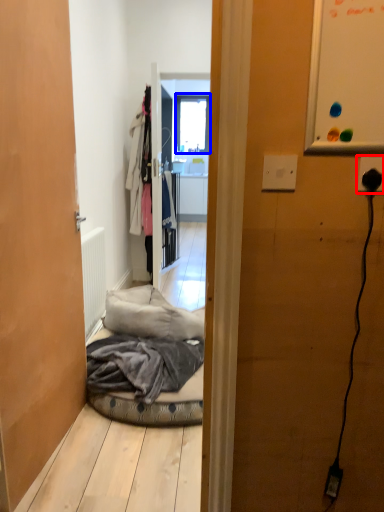
Question: Among these objects, which one is farthest to the camera, electric outlet (highlighted by a red box) or window (highlighted by a blue box)?

Choices:
 (A) electric outlet
 (B) window

Answer: (B)